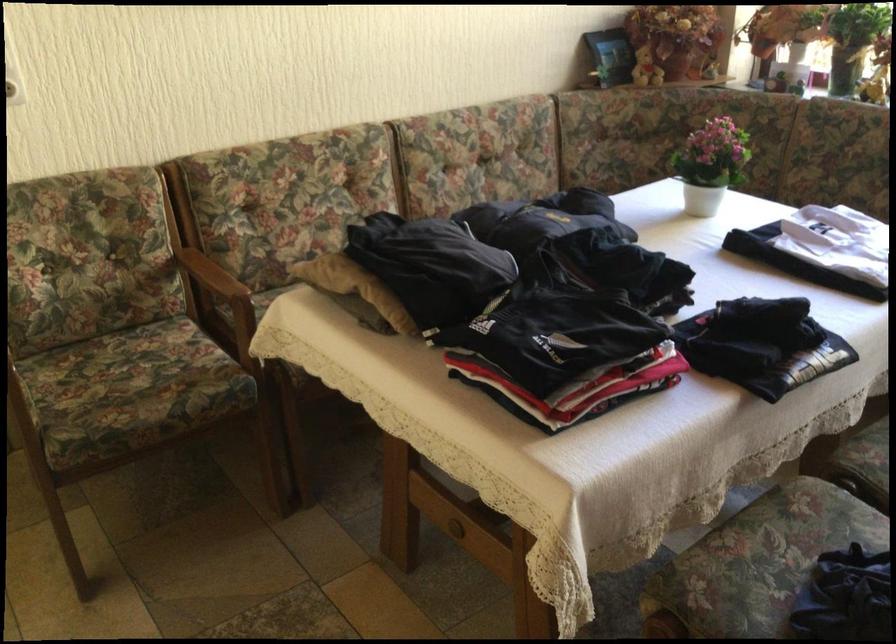
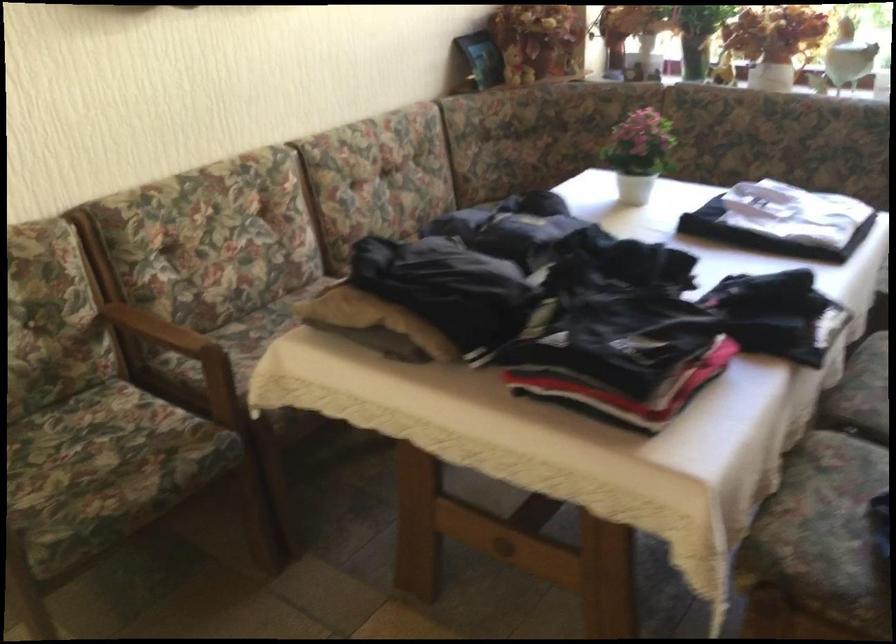
Question: How did the camera likely rotate?

Choices:
 (A) Left
 (B) Right
 (C) Up
 (D) Down

Answer: (B)